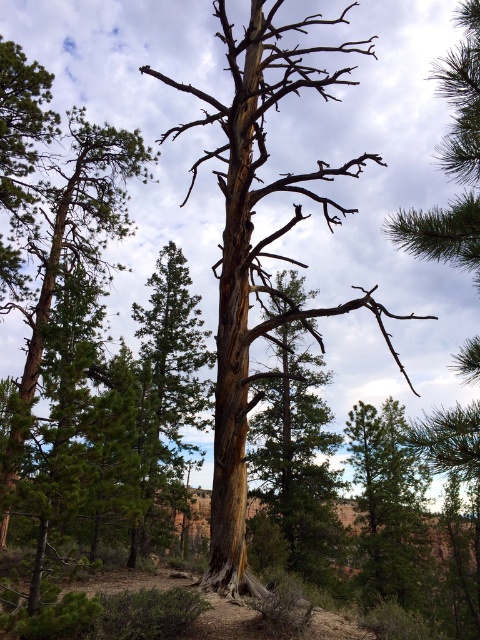
Does brown textured bark tree at center have a greater height compared to smooth bark tree at center?

Yes, brown textured bark tree at center is taller than smooth bark tree at center.

Is brown textured bark tree at center below smooth bark tree at center?

Incorrect, brown textured bark tree at center is not positioned below smooth bark tree at center.

Between point (240, 44) and point (282, 301), which one is positioned behind?

Positioned behind is point (282, 301).

This screenshot has height=640, width=480. I want to click on brown textured bark tree at center, so pos(257,252).

Measure the distance between point (297, 310) and camera.

Point (297, 310) and camera are 33.42 feet apart.

Is brown textured bark tree at center further to the viewer compared to green matte tree at center?

Yes, it is behind green matte tree at center.

Who is more distant from viewer, (225,113) or (392,460)?

Point (392,460)

Identify the location of brown textured bark tree at center. This screenshot has height=640, width=480. (257, 252).

Which of these two, smooth bark tree at center or green matte tree at center, stands shorter?

green matte tree at center is shorter.

Can you confirm if smooth bark tree at center is taller than green matte tree at center?

Correct, smooth bark tree at center is much taller as green matte tree at center.

Which is behind, point (292, 384) or point (382, 496)?

Positioned behind is point (292, 384).

The width and height of the screenshot is (480, 640). Find the location of `smooth bark tree at center`. smooth bark tree at center is located at coordinates (298, 458).